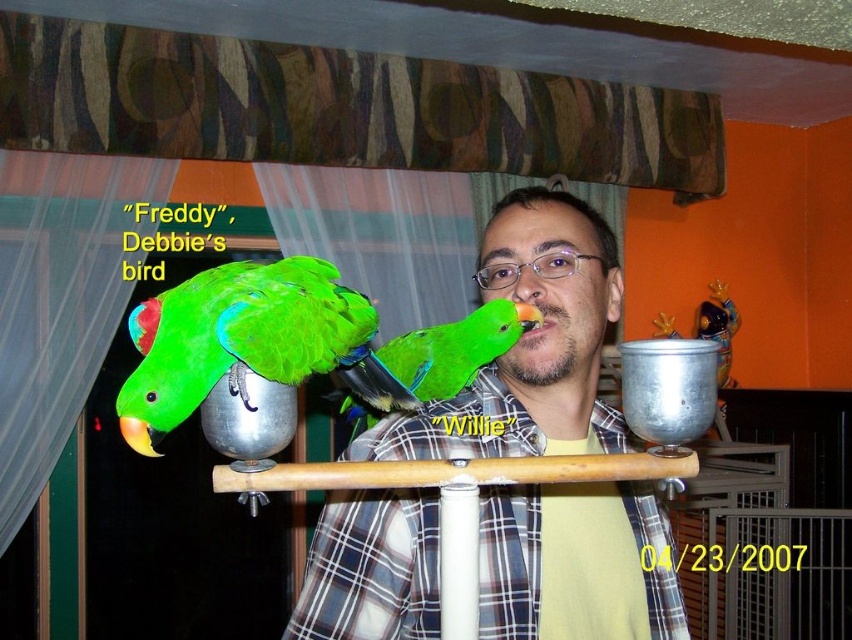
Can you confirm if matte green parrot at center is positioned above green matte parrot at center?

Actually, matte green parrot at center is below green matte parrot at center.

Image resolution: width=852 pixels, height=640 pixels. Describe the element at coordinates (528, 344) in the screenshot. I see `matte green parrot at center` at that location.

Locate an element on the screen. The image size is (852, 640). matte green parrot at center is located at coordinates (528, 344).

You are a GUI agent. You are given a task and a screenshot of the screen. Output one action in this format:
    pyautogui.click(x=<x>, y=<y>)
    Task: Click on the matte green parrot at center
    Image resolution: width=852 pixels, height=640 pixels.
    Given the screenshot: What is the action you would take?
    pyautogui.click(x=528, y=344)

Which is below, green matte parrot at left or green matte parrot at center?

Positioned lower is green matte parrot at center.

Between point (216, 381) and point (485, 344), which one is positioned in front?

Positioned in front is point (216, 381).

Identify the location of green matte parrot at left. (237, 339).

Can you confirm if matte green parrot at center is wider than green matte parrot at left?

Correct, the width of matte green parrot at center exceeds that of green matte parrot at left.

Does matte green parrot at center come behind green matte parrot at left?

Yes, it is behind green matte parrot at left.

Locate an element on the screen. The width and height of the screenshot is (852, 640). matte green parrot at center is located at coordinates (528, 344).

Image resolution: width=852 pixels, height=640 pixels. What are the coordinates of `matte green parrot at center` in the screenshot? It's located at (528, 344).